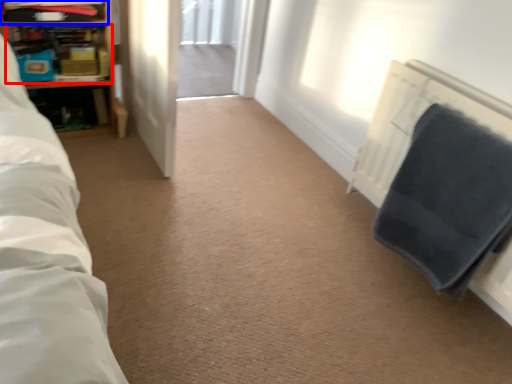
Question: Which point is closer to the camera, shelf (highlighted by a red box) or shelf (highlighted by a blue box)?

Choices:
 (A) shelf
 (B) shelf

Answer: (B)